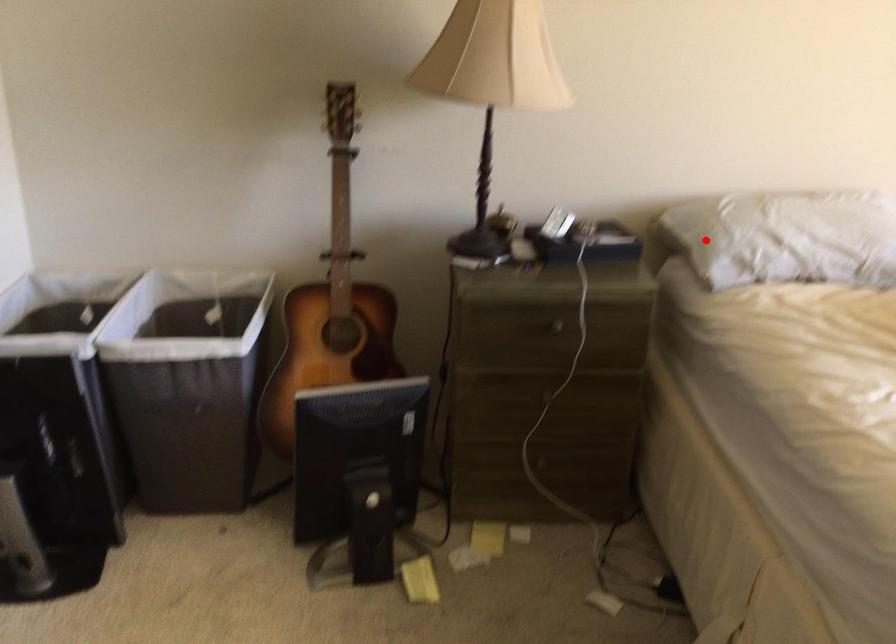
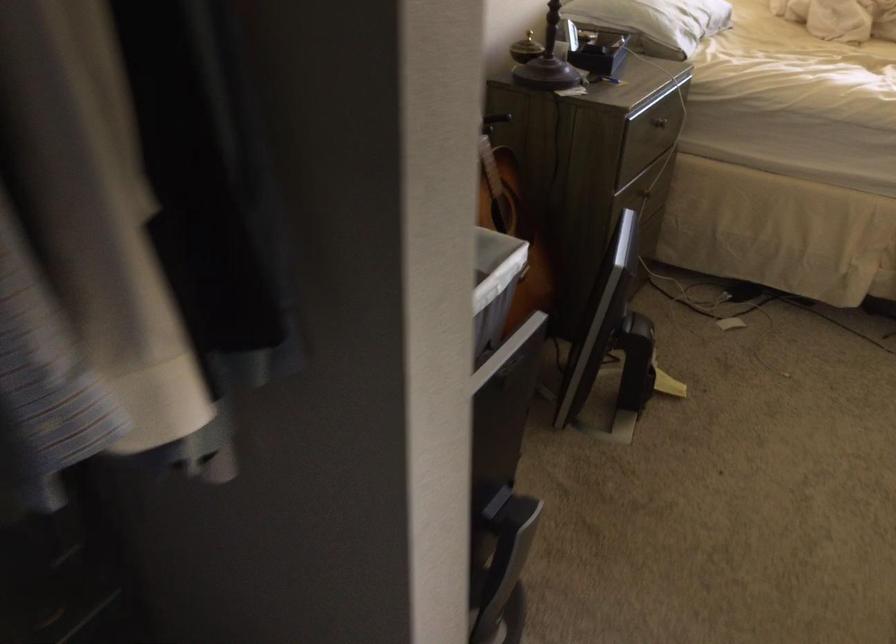
Question: I am providing you with two images of the same scene from different viewpoints. Given a red point in image1, look at the same physical point in image2. Is it:

Choices:
 (A) Closer to the viewpoint
 (B) Farther from the viewpoint

Answer: (B)